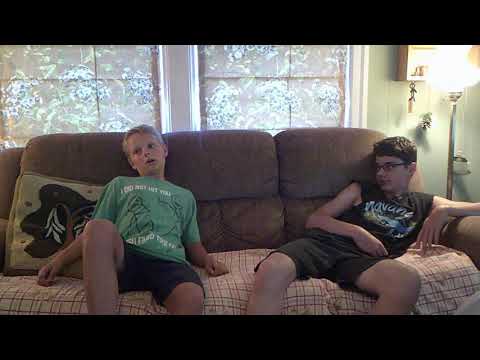
At what (x,y) coordinates should I click in order to perform the action: click on curtain sheers over window. Please return your answer as a coordinate pair (x, y). Image resolution: width=480 pixels, height=360 pixels. Looking at the image, I should click on (272, 99), (137, 87).